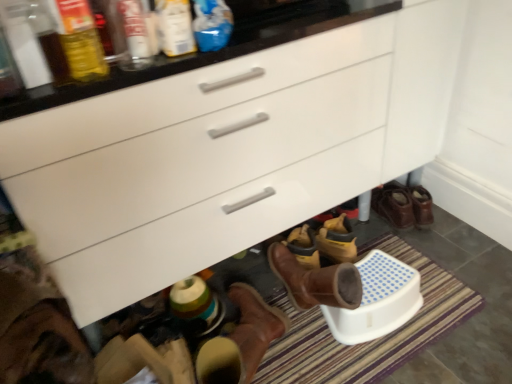
Question: Should I look upward or downward to see matte glass bottle at upper left, which ranks as the fourth bottle in right-to-left order?

Choices:
 (A) down
 (B) up

Answer: (B)

Question: Does brown leather boots at lower right have a greater height compared to blue plastic bottle at upper center, which appears as the first bottle when viewed from the right?

Choices:
 (A) yes
 (B) no

Answer: (A)

Question: Is brown leather boots at lower right facing away from blue plastic bottle at upper center, the fourth bottle in the left-to-right sequence?

Choices:
 (A) yes
 (B) no

Answer: (B)

Question: From a real-world perspective, is brown leather boots at lower right positioned under blue plastic bottle at upper center, the fourth bottle in the left-to-right sequence, based on gravity?

Choices:
 (A) yes
 (B) no

Answer: (A)

Question: Does brown leather boots at lower right have a lesser height compared to blue plastic bottle at upper center, the fourth bottle in the left-to-right sequence?

Choices:
 (A) no
 (B) yes

Answer: (A)

Question: Could you tell me if brown leather boots at lower right is turned towards blue plastic bottle at upper center, which appears as the first bottle when viewed from the right?

Choices:
 (A) yes
 (B) no

Answer: (B)

Question: Does brown leather boots at lower right appear on the right side of blue plastic bottle at upper center, which appears as the first bottle when viewed from the right?

Choices:
 (A) no
 (B) yes

Answer: (B)

Question: From the image's perspective, is striped carpet at lower center located above blue plastic bottle at upper center, the fourth bottle in the left-to-right sequence?

Choices:
 (A) no
 (B) yes

Answer: (A)

Question: Are striped carpet at lower center and blue plastic bottle at upper center, the fourth bottle in the left-to-right sequence, making contact?

Choices:
 (A) no
 (B) yes

Answer: (A)

Question: Can you confirm if striped carpet at lower center is smaller than blue plastic bottle at upper center, which appears as the first bottle when viewed from the right?

Choices:
 (A) yes
 (B) no

Answer: (B)

Question: From a real-world perspective, is striped carpet at lower center positioned under blue plastic bottle at upper center, the fourth bottle in the left-to-right sequence, based on gravity?

Choices:
 (A) no
 (B) yes

Answer: (B)

Question: From a real-world perspective, is striped carpet at lower center located higher than blue plastic bottle at upper center, which appears as the first bottle when viewed from the right?

Choices:
 (A) no
 (B) yes

Answer: (A)

Question: Considering the relative positions of striped carpet at lower center and blue plastic bottle at upper center, the fourth bottle in the left-to-right sequence, in the image provided, is striped carpet at lower center behind blue plastic bottle at upper center, the fourth bottle in the left-to-right sequence,?

Choices:
 (A) no
 (B) yes

Answer: (B)

Question: From the image's perspective, is matte plastic bottle at upper center, the 3th bottle when ordered from left to right, on translucent plastic bottle at upper left, which appears as the second bottle when viewed from the left?

Choices:
 (A) no
 (B) yes

Answer: (B)